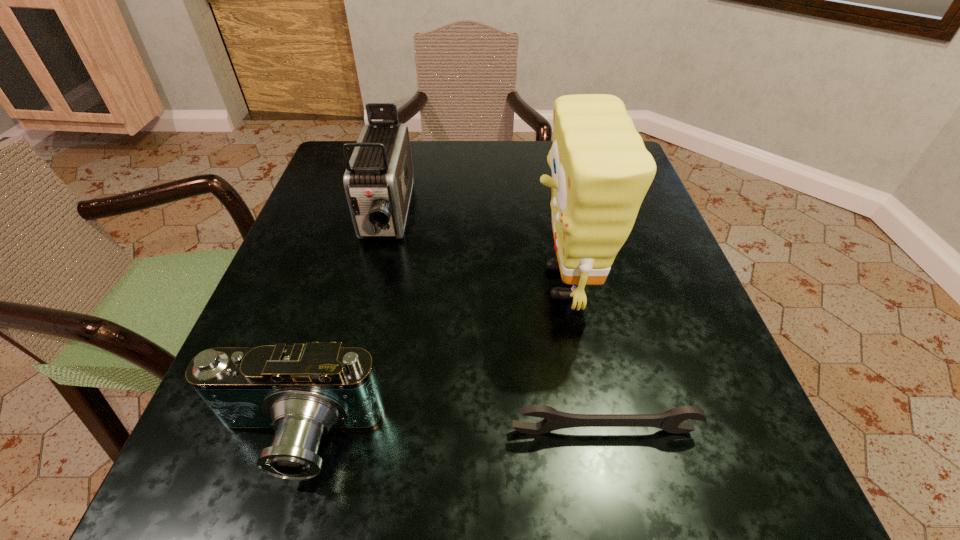
Locate an element on the screen. sponge is located at coordinates (601, 171).

Locate an element on the screen. Image resolution: width=960 pixels, height=540 pixels. the farther camcorder is located at coordinates (378, 181).

This screenshot has width=960, height=540. What are the coordinates of `the taller camcorder` in the screenshot? It's located at (378, 181).

This screenshot has height=540, width=960. In order to click on the second shortest object in this screenshot , I will do `click(302, 392)`.

Find the location of a particular element. This screenshot has width=960, height=540. the shorter camcorder is located at coordinates (302, 392).

The image size is (960, 540). I want to click on wrench, so click(671, 421).

This screenshot has height=540, width=960. Find the location of `free region located 0.150m on the face of the tallest object`. free region located 0.150m on the face of the tallest object is located at coordinates point(444,284).

This screenshot has height=540, width=960. I want to click on blank area located 0.240m on the face of the tallest object, so click(x=393, y=284).

At what (x,y) coordinates should I click in order to perform the action: click on free point located on the face of the tallest object. Please return your answer as a coordinate pair (x, y). The width and height of the screenshot is (960, 540). Looking at the image, I should click on click(x=364, y=284).

Locate an element on the screen. The image size is (960, 540). vacant space located at the lens of the taller camcorder is located at coordinates (324, 469).